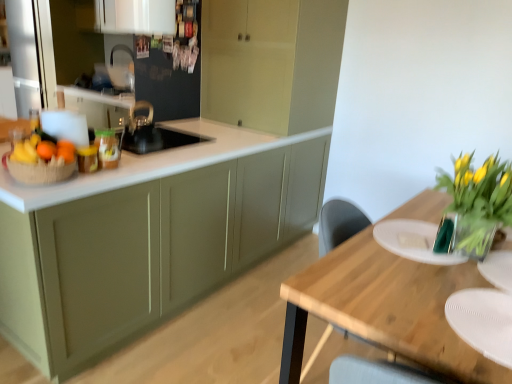
Identify the location of wooden table at center. (385, 308).

The height and width of the screenshot is (384, 512). I want to click on white matte plate at right, the first plate when ordered from back to front, so click(x=413, y=241).

Find the location of `wooden table at center`. wooden table at center is located at coordinates (385, 308).

From a real-world perspective, is white matte plate at right, which ranks as the first plate in top-to-bottom order, positioned above or below shiny yellow bananas at left?

white matte plate at right, which ranks as the first plate in top-to-bottom order, is situated lower than shiny yellow bananas at left in the real world.

At what (x,y) coordinates should I click in order to perform the action: click on fruit above the white matte plate at right, the second plate from the bottom (from a real-world perspective). Please return your answer as a coordinate pair (x, y). The height and width of the screenshot is (384, 512). Looking at the image, I should click on (42, 151).

Considering the positions of objects white matte plate at right, which ranks as the first plate in top-to-bottom order, and shiny yellow bananas at left in the image provided, who is behind, white matte plate at right, which ranks as the first plate in top-to-bottom order, or shiny yellow bananas at left?

Positioned behind is shiny yellow bananas at left.

Are white matte plate at right, the second plate from the bottom, and shiny yellow bananas at left beside each other?

No, white matte plate at right, the second plate from the bottom, is not next to shiny yellow bananas at left.

Could you tell me if wooden table at center is turned towards white matte plate at right, the 2th plate when ordered from front to back?

No, wooden table at center is not aimed at white matte plate at right, the 2th plate when ordered from front to back.

From a real-world perspective, is wooden table at center over white matte plate at right, the 2th plate when ordered from front to back?

No, from a real-world perspective, wooden table at center is not on top of white matte plate at right, the 2th plate when ordered from front to back.

Can you tell me how much wooden table at center and white matte plate at right, the second plate from the bottom, differ in facing direction?

The angular difference between wooden table at center and white matte plate at right, the second plate from the bottom, is 179 degrees.

From the picture: Between wooden table at center and white matte plate at right, the 2th plate when ordered from front to back, which one has more height?

With more height is wooden table at center.

Where is `floral arrangement above the matte green cabinets at center, the 2th cabinetry viewed from the front (from a real-world perspective)`? The image size is (512, 384). floral arrangement above the matte green cabinets at center, the 2th cabinetry viewed from the front (from a real-world perspective) is located at coordinates point(478,200).

How far apart are translucent glass vase at right and matte green cabinets at center, the 2th cabinetry viewed from the front?

A distance of 1.37 meters exists between translucent glass vase at right and matte green cabinets at center, the 2th cabinetry viewed from the front.

Between point (465, 215) and point (252, 150), which one is positioned behind?

The point (252, 150) is farther from the camera.

Is translucent glass vase at right to the left of matte green cabinets at center, placed as the 3th cabinetry when sorted from back to front, from the viewer's perspective?

No, translucent glass vase at right is not to the left of matte green cabinets at center, placed as the 3th cabinetry when sorted from back to front.

From a real-world perspective, between orange matte at left and brown woven basket at left, who is vertically lower?

brown woven basket at left.

Could you tell me if orange matte at left is facing brown woven basket at left?

No, orange matte at left is not turned towards brown woven basket at left.

Is shiny yellow bananas at left to the left or to the right of translucent glass vase at right in the image?

In the image, shiny yellow bananas at left appears on the left side of translucent glass vase at right.

Is shiny yellow bananas at left taller than translucent glass vase at right?

No.

Considering the sizes of shiny yellow bananas at left and translucent glass vase at right in the image, is shiny yellow bananas at left bigger or smaller than translucent glass vase at right?

shiny yellow bananas at left is smaller than translucent glass vase at right.

From a real-world perspective, is shiny yellow bananas at left on translucent glass vase at right?

Correct, in the physical world, shiny yellow bananas at left is higher than translucent glass vase at right.

Looking at this image, between orange matte at left and matte green cabinets at center, the 2th cabinetry viewed from the front, which one has smaller size?

Smaller between the two is orange matte at left.

Does orange matte at left appear on the right side of matte green cabinets at center, the 2th cabinetry viewed from the front?

In fact, orange matte at left is to the left of matte green cabinets at center, the 2th cabinetry viewed from the front.

Is orange matte at left touching matte green cabinets at center, placed as the 3th cabinetry when sorted from back to front?

No, orange matte at left is not next to matte green cabinets at center, placed as the 3th cabinetry when sorted from back to front.

From a real-world perspective, is orange matte at left above or below matte green cabinets at center, placed as the 3th cabinetry when sorted from back to front?

In terms of real-world spatial position, orange matte at left is above matte green cabinets at center, placed as the 3th cabinetry when sorted from back to front.

From a real-world perspective, is matte green cabinet at left, the first cabinetry viewed from the front, below shiny yellow bananas at left?

Yes, from a real-world perspective, matte green cabinet at left, the first cabinetry viewed from the front, is under shiny yellow bananas at left.

Is matte green cabinet at left, the first cabinetry viewed from the front, not near shiny yellow bananas at left?

matte green cabinet at left, the first cabinetry viewed from the front, is actually quite close to shiny yellow bananas at left.

Is matte green cabinet at left, the first cabinetry viewed from the front, not within shiny yellow bananas at left?

Yes, matte green cabinet at left, the first cabinetry viewed from the front, is not within shiny yellow bananas at left.

Is point (94, 261) farther from viewer compared to point (38, 162)?

Yes, it is behind point (38, 162).

This screenshot has height=384, width=512. I want to click on the 1st plate in front of the shiny yellow bananas at left, counting from the anchor's position, so click(413, 241).

This screenshot has width=512, height=384. In order to click on plate that is the 2nd object located above the wooden table at center (from the image's perspective) in this screenshot , I will do `click(413, 241)`.

Considering their positions, is white glossy cabinet at upper center, placed as the fourth cabinetry when sorted from front to back, positioned further to white matte plate at right, which ranks as the first plate in top-to-bottom order, than orange matte at left?

Among the two, white glossy cabinet at upper center, placed as the fourth cabinetry when sorted from front to back, is located further to white matte plate at right, which ranks as the first plate in top-to-bottom order.

From the image, which object appears to be farther from orange matte at left, white glossy cabinet at upper center, the 1th cabinetry viewed from the back, or white matte plate at right, the second plate from the bottom?

white matte plate at right, the second plate from the bottom.

Estimate the real-world distances between objects in this image. Which object is closer to white matte plate at right, the first plate when ordered from back to front, matte green cabinets at center, placed as the 3th cabinetry when sorted from back to front, or white matte plate at lower right, marked as the 2th plate in a back-to-front arrangement?

white matte plate at lower right, marked as the 2th plate in a back-to-front arrangement, is positioned closer to the anchor white matte plate at right, the first plate when ordered from back to front.

From the image, which object appears to be farther from white matte plate at lower right, arranged as the 2th plate when viewed from the top, translucent glass vase at right or orange matte at left?

The object further to white matte plate at lower right, arranged as the 2th plate when viewed from the top, is orange matte at left.

Which object lies nearer to the anchor point matte green cabinets at center, the 2th cabinetry viewed from the front, matte green cabinet at left, which is the 4th cabinetry from back to front, or orange matte at left?

matte green cabinet at left, which is the 4th cabinetry from back to front, is closer to matte green cabinets at center, the 2th cabinetry viewed from the front.

Looking at the image, which one is located further to matte green cabinets at center, the third cabinetry in the front-to-back sequence, brown woven basket at left or white glossy cabinet at upper center, the 1th cabinetry viewed from the back?

Result: Based on the image, brown woven basket at left appears to be further to matte green cabinets at center, the third cabinetry in the front-to-back sequence.

From the image, which object appears to be farther from white matte plate at lower right, arranged as the 2th plate when viewed from the top, orange matte at left or matte green cabinets at center, placed as the 3th cabinetry when sorted from back to front?

The object further to white matte plate at lower right, arranged as the 2th plate when viewed from the top, is orange matte at left.

Considering their positions, is wooden table at center positioned further to matte green cabinet at left, the first cabinetry viewed from the front, than matte green cabinets at center, the third cabinetry in the front-to-back sequence?

matte green cabinets at center, the third cabinetry in the front-to-back sequence.

Where is `tangerine situated between brown woven basket at left and translucent glass vase at right from left to right`? The image size is (512, 384). tangerine situated between brown woven basket at left and translucent glass vase at right from left to right is located at coordinates (46, 150).

The height and width of the screenshot is (384, 512). Identify the location of orange located between orange matte at left and matte green cabinets at center, which is the second cabinetry in back-to-front order, in the left-right direction. (66, 153).

Locate an element on the screen. This screenshot has height=384, width=512. basket between shiny yellow bananas at left and translucent glass vase at right in the horizontal direction is located at coordinates (39, 172).

This screenshot has width=512, height=384. In order to click on fruit between matte green cabinet at left, the first cabinetry viewed from the front, and matte green cabinets at center, placed as the 3th cabinetry when sorted from back to front in this screenshot , I will do `click(42, 151)`.